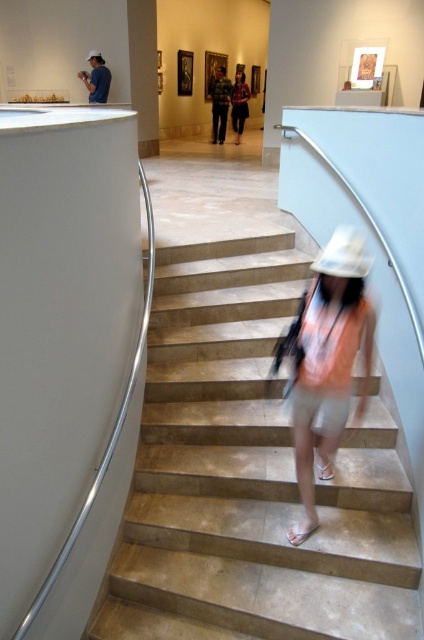
Who is positioned more to the right, beige marble stairs at center or dark green shirt at center?

Positioned to the right is dark green shirt at center.

Is beige marble stairs at center in front of dark green shirt at center?

Yes, beige marble stairs at center is in front of dark green shirt at center.

Does point (251, 339) come closer to viewer compared to point (233, 129)?

Yes, it is in front of point (233, 129).

At what (x,y) coordinates should I click in order to perform the action: click on beige marble stairs at center. Please return your answer as a coordinate pair (x, y). Looking at the image, I should click on point(250,476).

Can you confirm if light pink fabric hat at center is shorter than green plaid shirt at center?

No, light pink fabric hat at center is not shorter than green plaid shirt at center.

Is light pink fabric hat at center above green plaid shirt at center?

No, light pink fabric hat at center is not above green plaid shirt at center.

Where is `light pink fabric hat at center`? Image resolution: width=424 pixels, height=640 pixels. light pink fabric hat at center is located at coordinates (326, 360).

Identify the location of beige marble stairs at center. (250, 476).

Where is `beige marble stairs at center`? beige marble stairs at center is located at coordinates [x=250, y=476].